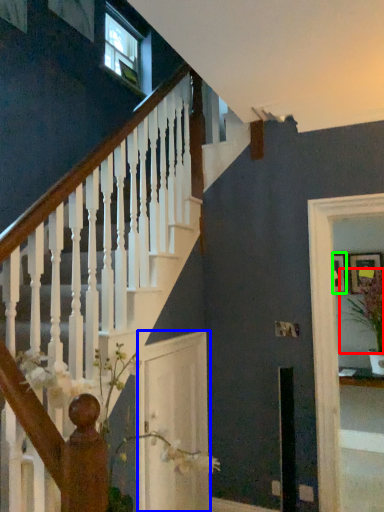
Question: Which object is the closest to the plant (highlighted by a red box)? Choose among these: glass door (highlighted by a blue box) or picture frame (highlighted by a green box).

Choices:
 (A) glass door
 (B) picture frame

Answer: (B)